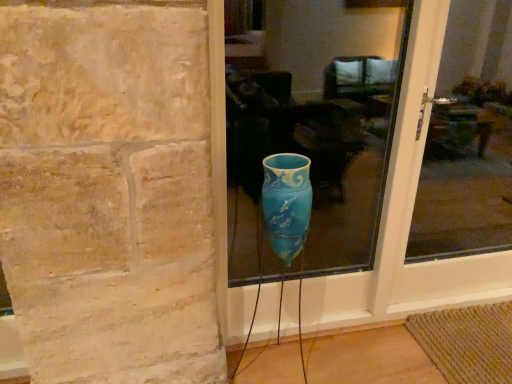
At what (x,y) coordinates should I click in order to perform the action: click on blank area to the left of transparent glass door at center, the 1th glass window when ordered from right to left. Please return your answer as a coordinate pair (x, y). Image resolution: width=512 pixels, height=384 pixels. Looking at the image, I should click on [x=380, y=345].